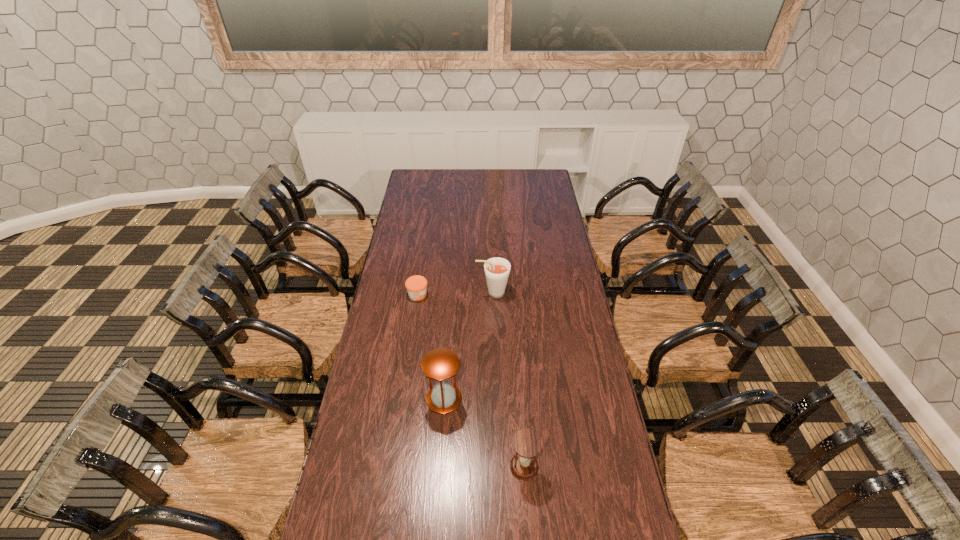
At what (x,y) coordinates should I click in order to perform the action: click on vacant point located between the second object from left to right and the root beer. Please return your answer as a coordinate pair (x, y). Looking at the image, I should click on (468, 346).

Find the location of a particular element. free space between the root beer and the second nearest object is located at coordinates (468, 346).

This screenshot has height=540, width=960. Find the location of `free space between the left hourglass and the leftmost object`. free space between the left hourglass and the leftmost object is located at coordinates (431, 347).

At what (x,y) coordinates should I click in order to perform the action: click on empty space between the shortest object and the right hourglass. Please return your answer as a coordinate pair (x, y). Looking at the image, I should click on (471, 381).

This screenshot has width=960, height=540. Find the location of `free space that is in between the farther hourglass and the root beer`. free space that is in between the farther hourglass and the root beer is located at coordinates (468, 346).

The image size is (960, 540). What are the coordinates of `free space between the shortest object and the right hourglass` in the screenshot? It's located at (471, 381).

This screenshot has height=540, width=960. I want to click on vacant space in between the root beer and the jam, so [x=455, y=294].

You are a GUI agent. You are given a task and a screenshot of the screen. Output one action in this format:
    pyautogui.click(x=<x>, y=<y>)
    Task: Click on the vacant space that is in between the taller hourglass and the leftmost object
    The width and height of the screenshot is (960, 540).
    Given the screenshot: What is the action you would take?
    pyautogui.click(x=431, y=347)

Find the location of a particular element. The image size is (960, 540). the closest object relative to the leftmost object is located at coordinates (497, 269).

Find the location of `object that is the second closest to the shortest object`. object that is the second closest to the shortest object is located at coordinates (440, 364).